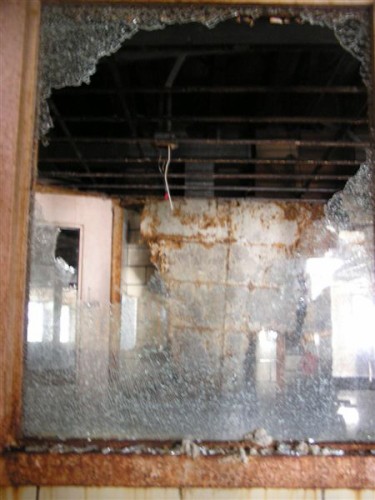
What are the coordinates of `white wall` in the screenshot? It's located at (123, 269), (156, 274), (266, 358), (263, 382).